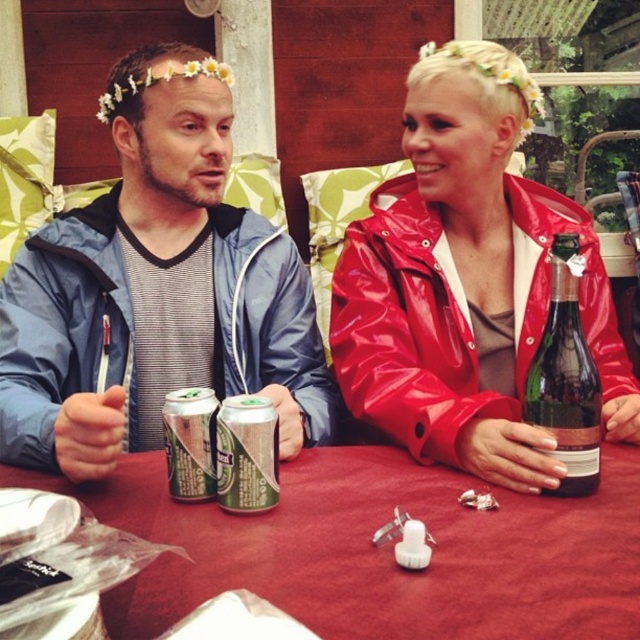
Who is lower down, matte blue jacket at left or green metallic can at center?

green metallic can at center is below.

Between matte blue jacket at left and green metallic can at center, which one appears on the right side from the viewer's perspective?

Positioned to the right is green metallic can at center.

The height and width of the screenshot is (640, 640). Find the location of `matte blue jacket at left`. matte blue jacket at left is located at coordinates (156, 289).

From the picture: Between smooth red table at center and green metallic can at center, which one has less height?

Standing shorter between the two is smooth red table at center.

Does point (164, 468) come in front of point (234, 449)?

That is False.

What do you see at coordinates (380, 550) in the screenshot?
I see `smooth red table at center` at bounding box center [380, 550].

Find the location of `smooth red table at center`. smooth red table at center is located at coordinates (380, 550).

Which is in front, point (592, 476) or point (198, 387)?

Point (592, 476) is in front.

Measure the distance between green glass bottle at center and silver metallic can at center.

A distance of 16.29 inches exists between green glass bottle at center and silver metallic can at center.

Does point (586, 352) lie behind point (204, 419)?

Yes.

The image size is (640, 640). In order to click on green glass bottle at center in this screenshot , I will do `click(564, 378)`.